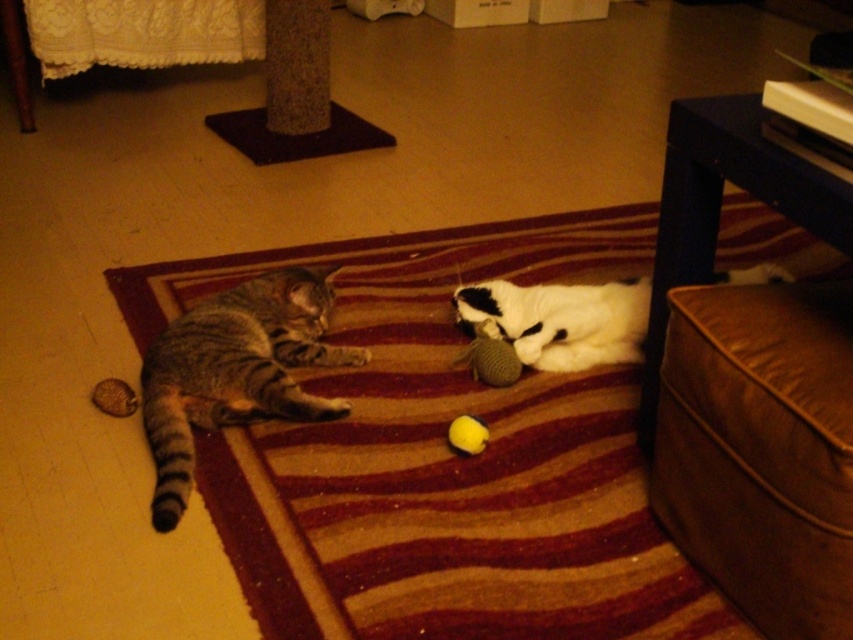
Question: Among these objects, which one is nearest to the camera?

Choices:
 (A) brown leather ottoman at lower right
 (B) striped carpet at center

Answer: (A)

Question: Does striped carpet at center appear on the right side of tabby fur cat at left?

Choices:
 (A) yes
 (B) no

Answer: (A)

Question: Which of the following is the farthest from the observer?

Choices:
 (A) coord(247,404)
 (B) coord(213,445)

Answer: (A)

Question: Which point is closer to the camera?

Choices:
 (A) yellow rubber ball at center
 (B) brown leather ottoman at lower right
 (C) tabby fur cat at left
 (D) soft brown plush ball at left

Answer: (B)

Question: Is brown leather ottoman at lower right closer to camera compared to tabby fur cat at left?

Choices:
 (A) yes
 (B) no

Answer: (A)

Question: Can you confirm if tabby fur cat at left is thinner than white soft plush at center?

Choices:
 (A) no
 (B) yes

Answer: (B)